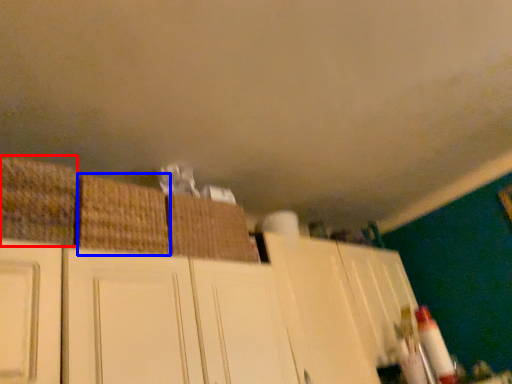
Question: Which object appears closest to the camera in this image, basket (highlighted by a red box) or basket (highlighted by a blue box)?

Choices:
 (A) basket
 (B) basket

Answer: (A)